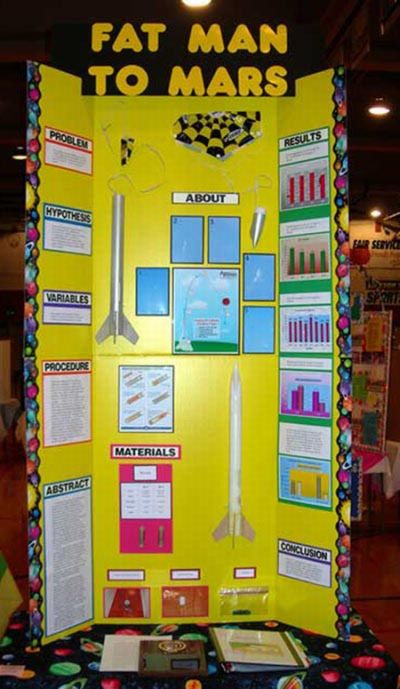
At what (x,y) coordinates should I click in order to perform the action: click on tablecloth. Please return your answer as a coordinate pair (x, y). This screenshot has height=689, width=400. Looking at the image, I should click on (324, 655).